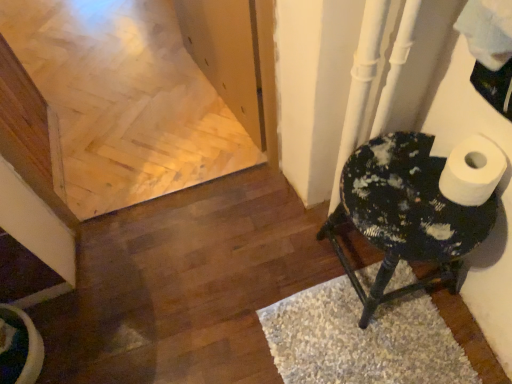
Question: Does point (390, 256) appear closer or farther from the camera than point (410, 269)?

Choices:
 (A) closer
 (B) farther

Answer: (A)

Question: Looking at their shapes, would you say speckled black stool at right is wider or thinner than white shaggy rug at lower right?

Choices:
 (A) thin
 (B) wide

Answer: (A)

Question: From a real-world perspective, is speckled black stool at right physically located above or below white shaggy rug at lower right?

Choices:
 (A) below
 (B) above

Answer: (B)

Question: Looking at their shapes, would you say white shaggy rug at lower right is wider or thinner than speckled black stool at right?

Choices:
 (A) wide
 (B) thin

Answer: (A)

Question: From the image's perspective, is white shaggy rug at lower right above or below speckled black stool at right?

Choices:
 (A) below
 (B) above

Answer: (A)

Question: Is white shaggy rug at lower right in front of or behind speckled black stool at right in the image?

Choices:
 (A) front
 (B) behind

Answer: (B)

Question: Is white shaggy rug at lower right bigger or smaller than speckled black stool at right?

Choices:
 (A) small
 (B) big

Answer: (A)